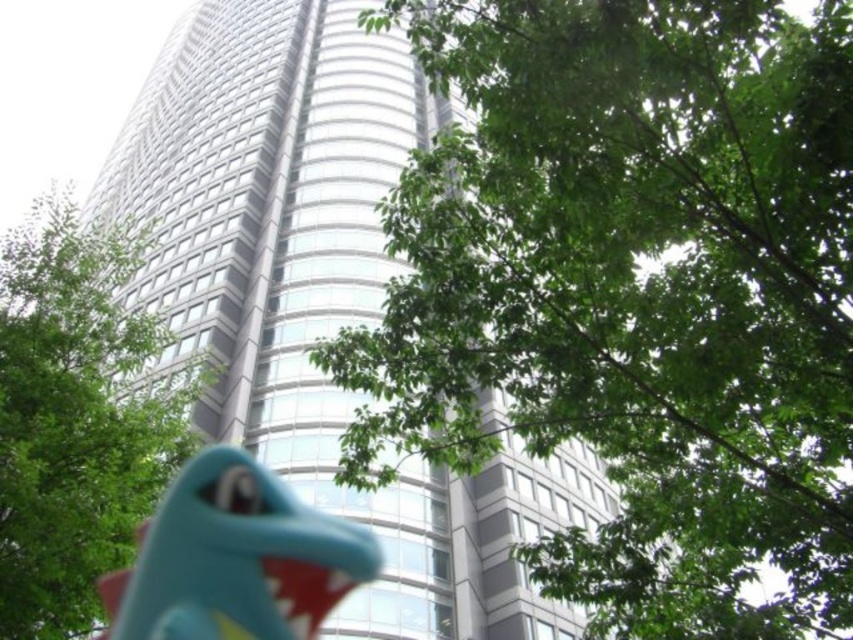
You are a photographer standing in front of the modern building. You want to take a photo that includes both the green leafy tree at center and the teal rubber dinosaur at lower center. Which object will appear bigger in the photo?

The green leafy tree at center will appear bigger in the photo because it is larger in size than the teal rubber dinosaur at lower center.

You are a photographer trying to capture the glassy silver tower at center and the teal rubber dinosaur at lower center in the same frame. Based on their sizes, which object will appear larger in the photo?

The glassy silver tower at center will appear larger in the photo because it has a greater height compared to the teal rubber dinosaur at lower center.

You are a city planner reviewing a proposed design for a new park. The design includes both a green leafy tree at center and a glassy silver tower at center. Based on the image, which object would require more space in terms of size?

The glassy silver tower at center is larger than the green leafy tree at center, so it would require more space in terms of size.